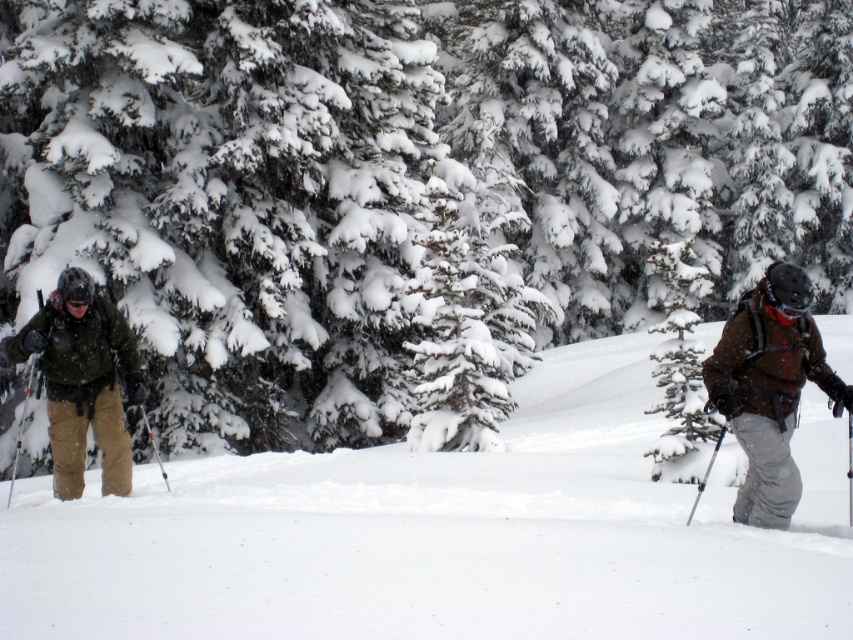
You are planning to take a photo of the white snow ski slope at left and the matte green jacket at left. Which object should you focus on if you want to capture the larger subject in your frame?

The white snow ski slope at left is bigger than the matte green jacket at left, so you should focus on the white snow ski slope at left to capture the larger subject in your frame.

You are a photographer planning to take a photo of the white snow ski slope at left and the matte green jacket at left. Which object should you focus on first to ensure it appears sharp in the photo?

You should focus on the white snow ski slope at left first because it is closer to you than the matte green jacket at left, so it should be in focus first to ensure sharpness.

You are a photographer standing at the camera position. You want to take a closeup photo of the brown woolen jacket at right. Is the jacket within your camera range if your camera can focus up to 5 meters?

The brown woolen jacket at right is 7.22 meters away from camera, which is beyond the camera focus range of 5 meters. Therefore, the jacket is out of focus range.